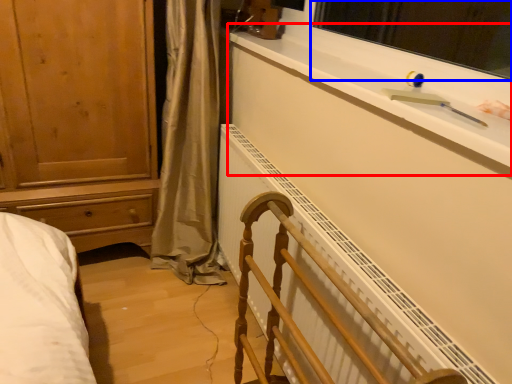
Question: Among these objects, which one is farthest to the camera, window sill (highlighted by a red box) or window screen (highlighted by a blue box)?

Choices:
 (A) window sill
 (B) window screen

Answer: (B)